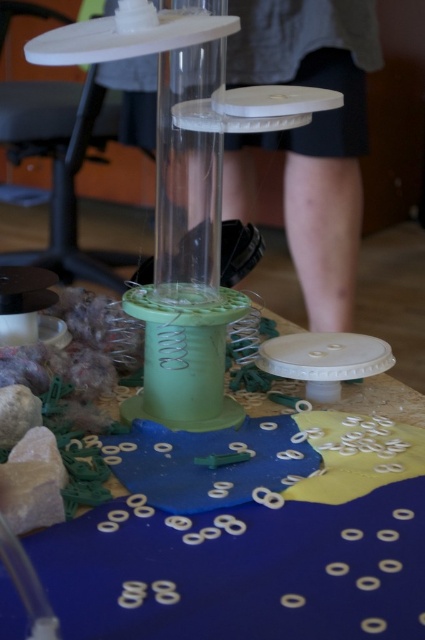
Question: Which object appears closest to the camera in this image?

Choices:
 (A) transparent plastic glass vase at center
 (B) blue fabric at center

Answer: (B)

Question: In this image, where is blue fabric at center located relative to transparent plastic glass vase at center?

Choices:
 (A) left
 (B) right

Answer: (B)

Question: Does blue fabric at center have a lesser width compared to transparent plastic glass vase at center?

Choices:
 (A) yes
 (B) no

Answer: (B)

Question: Can you confirm if blue fabric at center is positioned to the left of transparent plastic glass vase at center?

Choices:
 (A) yes
 (B) no

Answer: (B)